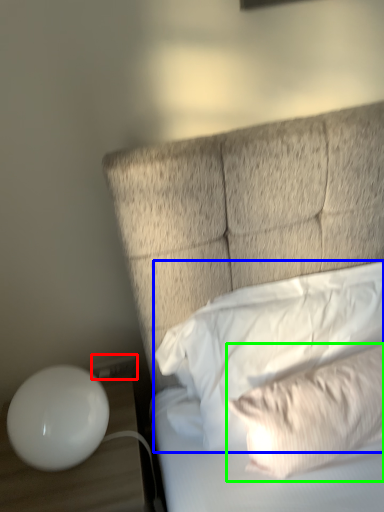
Question: Based on their relative distances, which object is farther from electric outlet (highlighted by a red box)? Choose from pillow (highlighted by a blue box) and pillow (highlighted by a green box).

Choices:
 (A) pillow
 (B) pillow

Answer: (B)